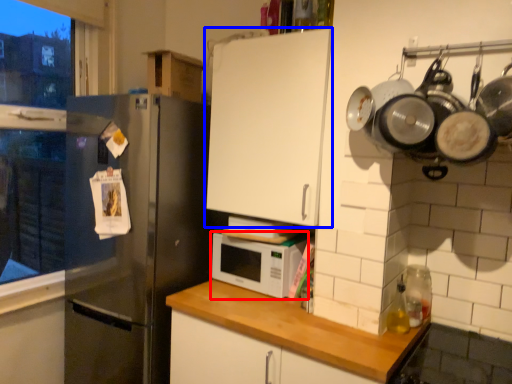
Question: Which object appears farthest to the camera in this image, microwave oven (highlighted by a red box) or cabinetry (highlighted by a blue box)?

Choices:
 (A) microwave oven
 (B) cabinetry

Answer: (A)